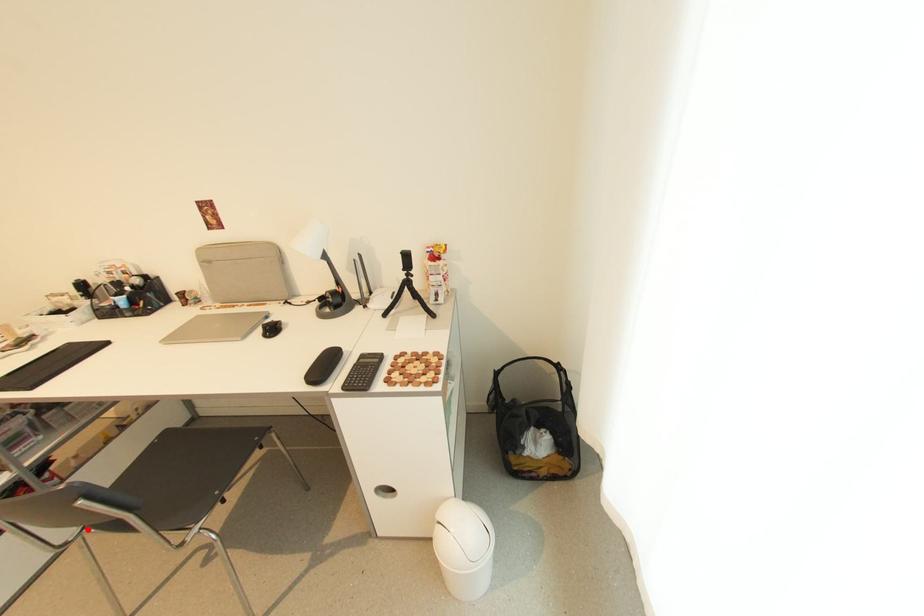
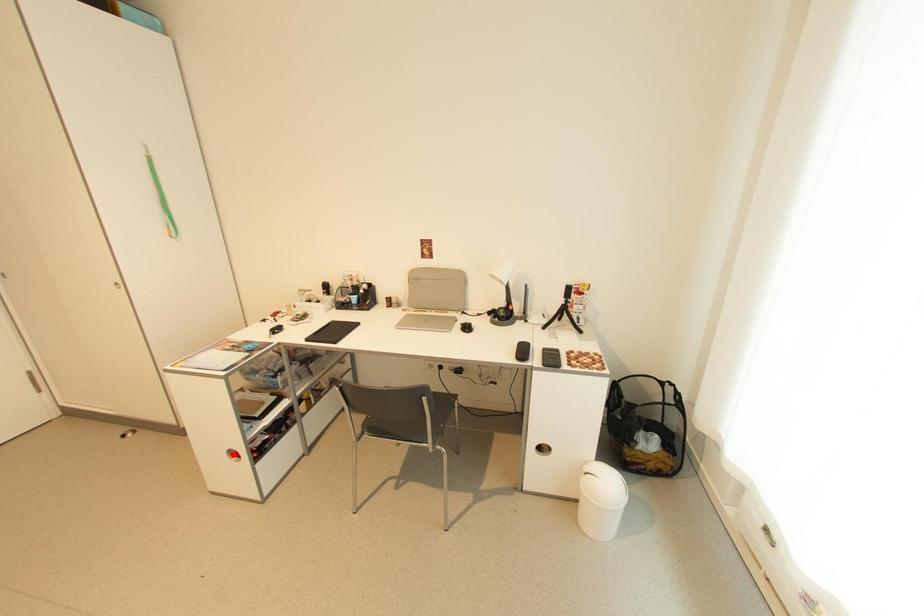
I am providing you with two images of the same scene from different viewpoints. A red point is marked on the first image and another point is marked on the second image. Are the points marked in image1 and image2 representing the same 3D position?

No